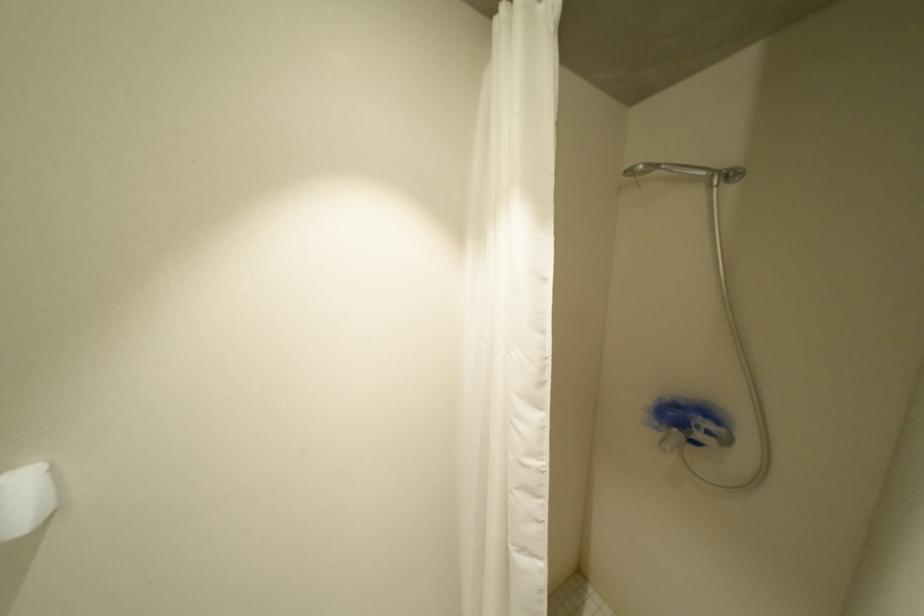
Find the location of a particular element. blue shower sponge is located at coordinates (690, 419).